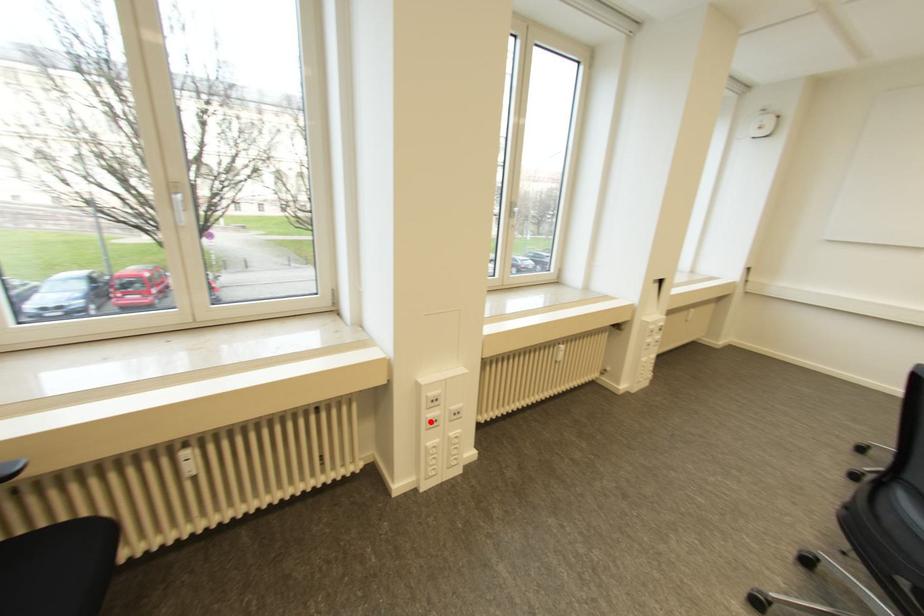
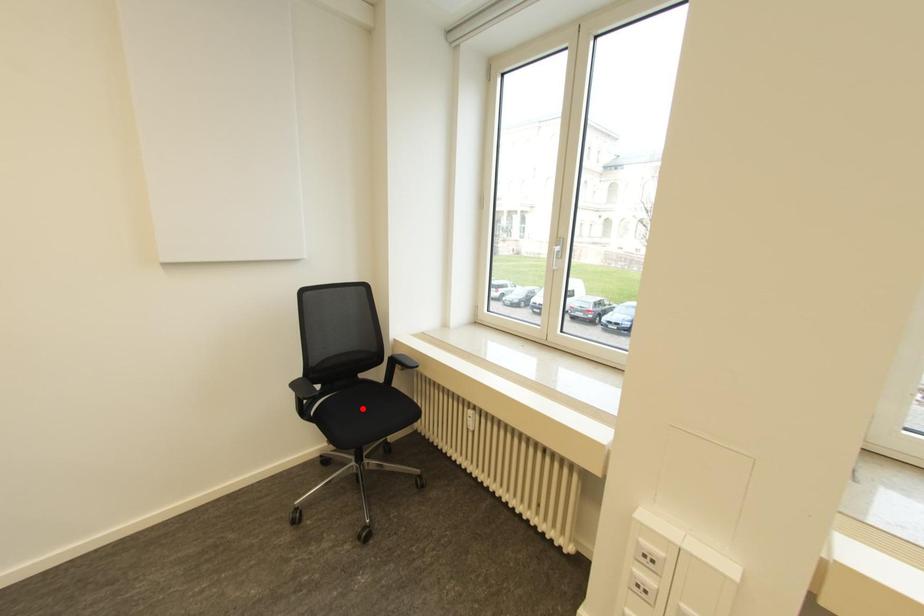
I am providing you with two images of the same scene from different viewpoints. A red point is marked on the first image and another point is marked on the second image. Does the point marked in image1 correspond to the same location as the one in image2?

No